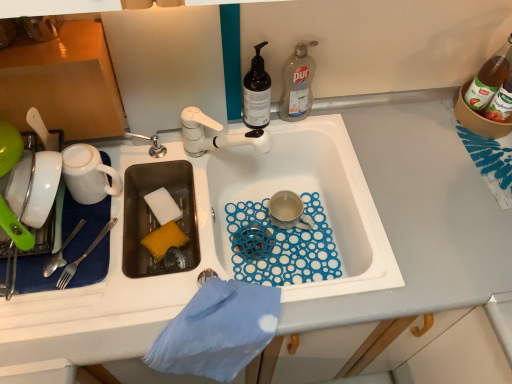
Locate an element on the screen. The height and width of the screenshot is (384, 512). free space in front of white matte mug at upper left, marked as the 2th coffee cup in a right-to-left arrangement is located at coordinates (99, 268).